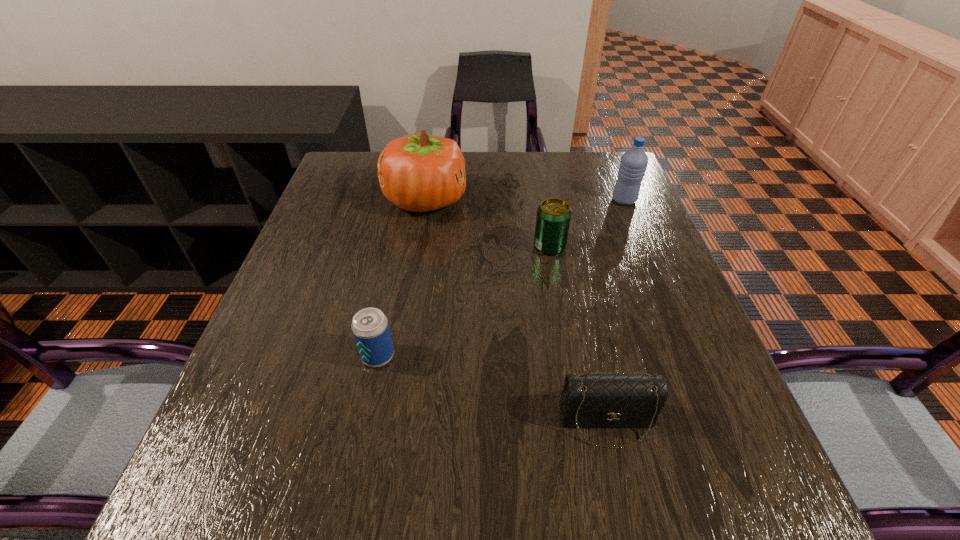
Locate an element on the screen. The image size is (960, 540). unoccupied position between the left beer can and the pumpkin is located at coordinates (401, 278).

Where is `free space between the rightmost object and the right beer can`? This screenshot has height=540, width=960. free space between the rightmost object and the right beer can is located at coordinates (587, 224).

The height and width of the screenshot is (540, 960). Identify the location of vacant area that lies between the farther beer can and the pumpkin. (488, 223).

You are a GUI agent. You are given a task and a screenshot of the screen. Output one action in this format:
    pyautogui.click(x=<x>, y=<y>)
    Task: Click on the free spot between the right beer can and the pumpkin
    The image size is (960, 540).
    Given the screenshot: What is the action you would take?
    pyautogui.click(x=488, y=223)

At what (x,y) coordinates should I click in order to perform the action: click on object that ranks as the fourth closest to the water bottle. Please return your answer as a coordinate pair (x, y). Looking at the image, I should click on (370, 327).

Identify the location of object that ranks as the second closest to the rightmost object. This screenshot has height=540, width=960. (419, 172).

The width and height of the screenshot is (960, 540). What are the coordinates of `free space that satisfies the following two spatial constraints: 1. on the back side of the rightmost object; 2. on the side of the pumpkin with the cute face` in the screenshot? It's located at (624, 200).

The image size is (960, 540). In order to click on free space that satisfies the following two spatial constraints: 1. on the side of the pumpkin with the cute face; 2. on the left side of the right beer can in this screenshot , I will do `click(418, 247)`.

Locate an element on the screen. free space that satisfies the following two spatial constraints: 1. on the side of the pumpkin with the cute face; 2. on the left side of the rightmost object is located at coordinates coord(425,200).

Identify the location of vacant region that satisfies the following two spatial constraints: 1. on the back side of the fourth farthest object; 2. on the left side of the water bottle. This screenshot has height=540, width=960. (409, 200).